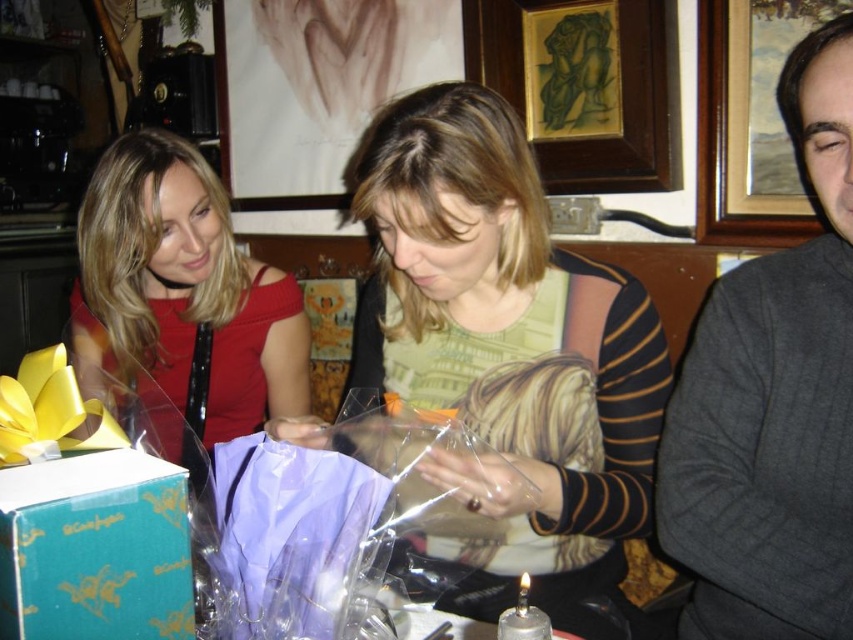
Question: Can you confirm if green paper box at lower left is wider than wooden picture frame at upper right?

Choices:
 (A) no
 (B) yes

Answer: (A)

Question: Which point is closer to the camera?

Choices:
 (A) matte green sweater at center
 (B) wooden picture frame at upper right
 (C) purple satin shirt at center
 (D) green paper box at lower left

Answer: (D)

Question: Is the position of green paper box at lower left less distant than that of wooden framed artwork at upper center?

Choices:
 (A) no
 (B) yes

Answer: (B)

Question: Which of the following is the farthest from the observer?

Choices:
 (A) purple satin shirt at center
 (B) green paper box at lower left

Answer: (A)

Question: Is gray textured sweater at right positioned before purple satin shirt at center?

Choices:
 (A) no
 (B) yes

Answer: (A)

Question: Which object is closer to the camera taking this photo?

Choices:
 (A) gray textured sweater at right
 (B) matte red dress at left
 (C) green paper box at lower left
 (D) wooden picture frame at upper right

Answer: (C)